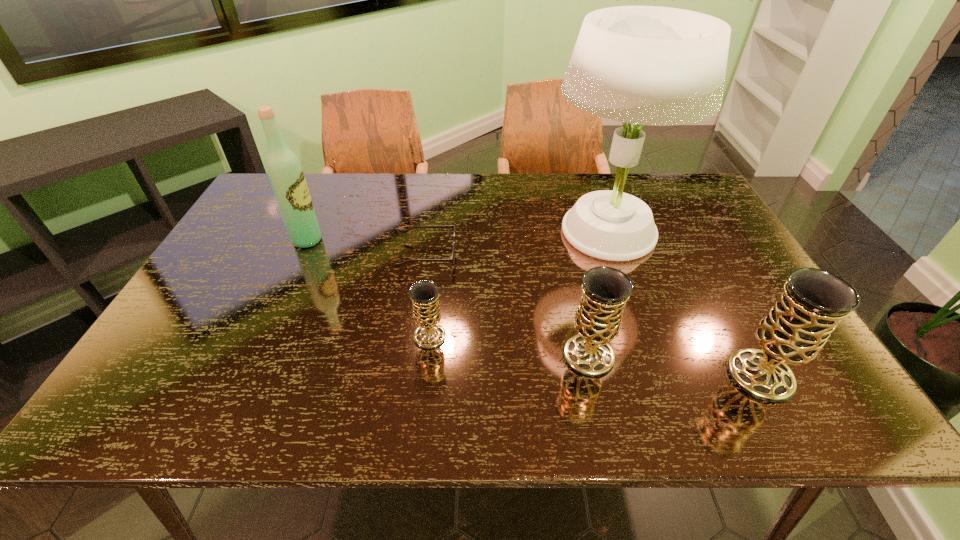
This screenshot has width=960, height=540. I want to click on vacant place for an extra chalice on the left, so click(282, 319).